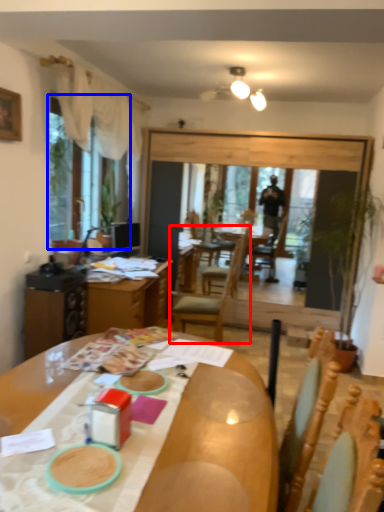
Question: Which object is closer to the camera taking this photo, chair (highlighted by a red box) or window screen (highlighted by a blue box)?

Choices:
 (A) chair
 (B) window screen

Answer: (B)